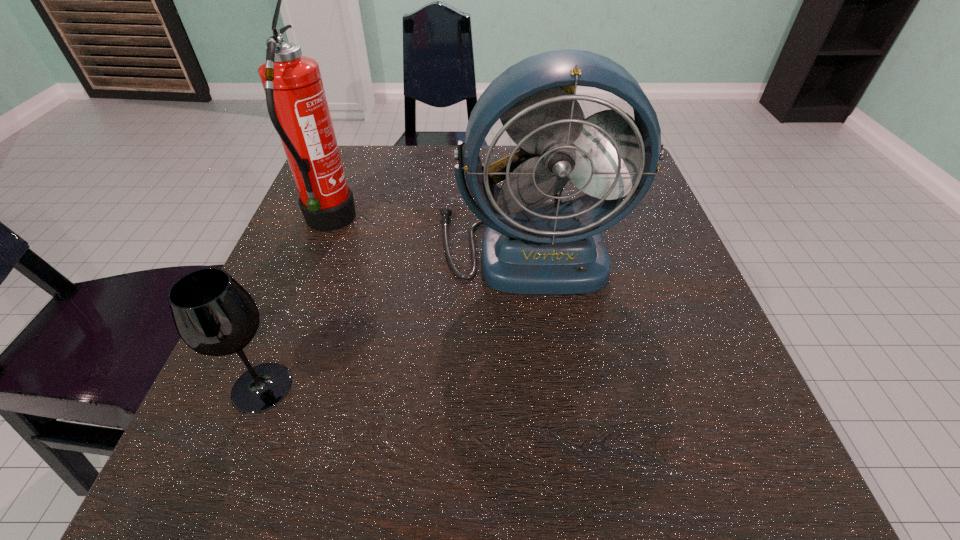
Where is `fire extinguisher`? fire extinguisher is located at coordinates (297, 105).

Image resolution: width=960 pixels, height=540 pixels. What are the coordinates of `the rightmost object` in the screenshot? It's located at (531, 248).

Find the location of `the shortest object`. the shortest object is located at coordinates (214, 315).

Locate an element on the screen. The width and height of the screenshot is (960, 540). the nearest object is located at coordinates (214, 315).

You are a GUI agent. You are given a task and a screenshot of the screen. Output one action in this format:
    pyautogui.click(x=<x>, y=<y>)
    Task: Click on the vacant region located 0.150m on the front-facing side of the fire extinguisher
    The image size is (960, 540).
    Given the screenshot: What is the action you would take?
    pyautogui.click(x=430, y=222)

This screenshot has width=960, height=540. What are the coordinates of `vacant area located 0.280m in front of the fan to blow air` in the screenshot? It's located at (557, 461).

I want to click on free space located on the right of the wineglass, so (x=398, y=387).

In order to click on object located in the far edge section of the desktop in this screenshot , I will do `click(297, 105)`.

Where is `fire extinguisher located at the left edge`? fire extinguisher located at the left edge is located at coordinates (297, 105).

I want to click on wineglass that is at the left edge, so click(214, 315).